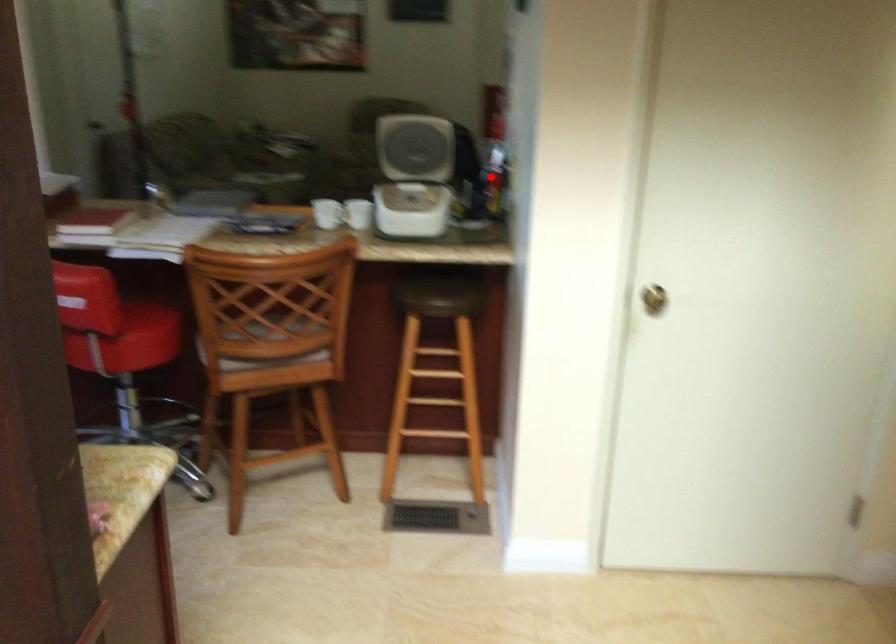
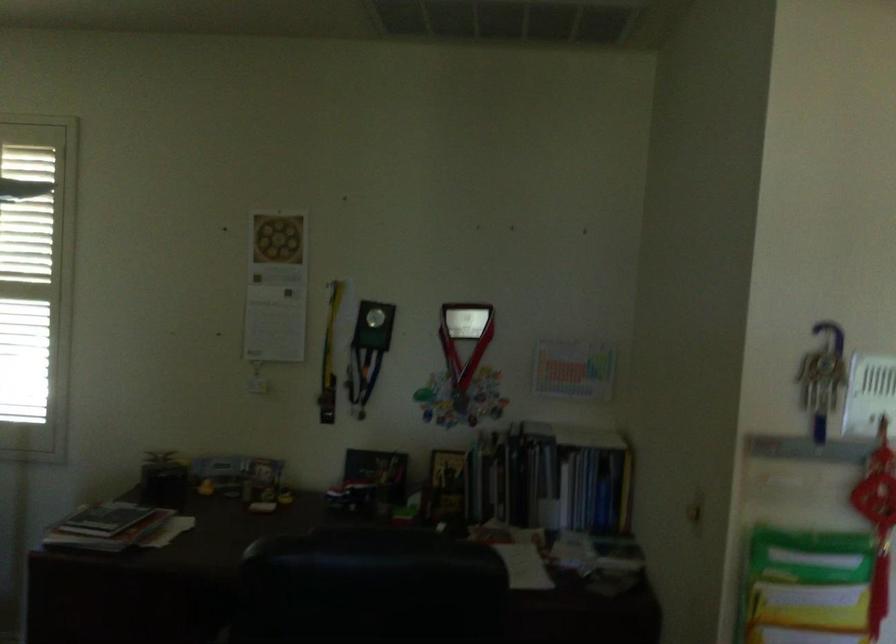
Where in the second image is the point corresponding to the highlighted location from the first image?

(812, 614)